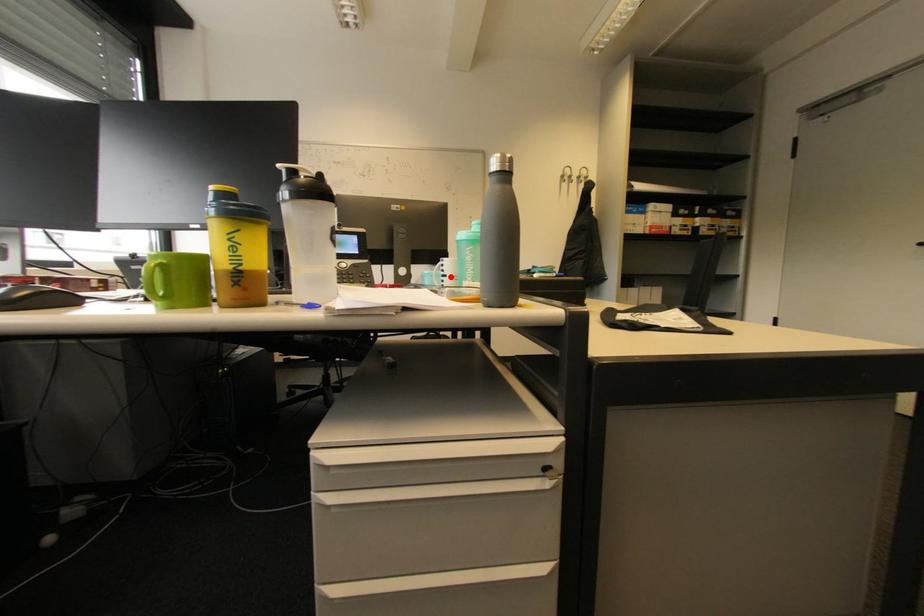
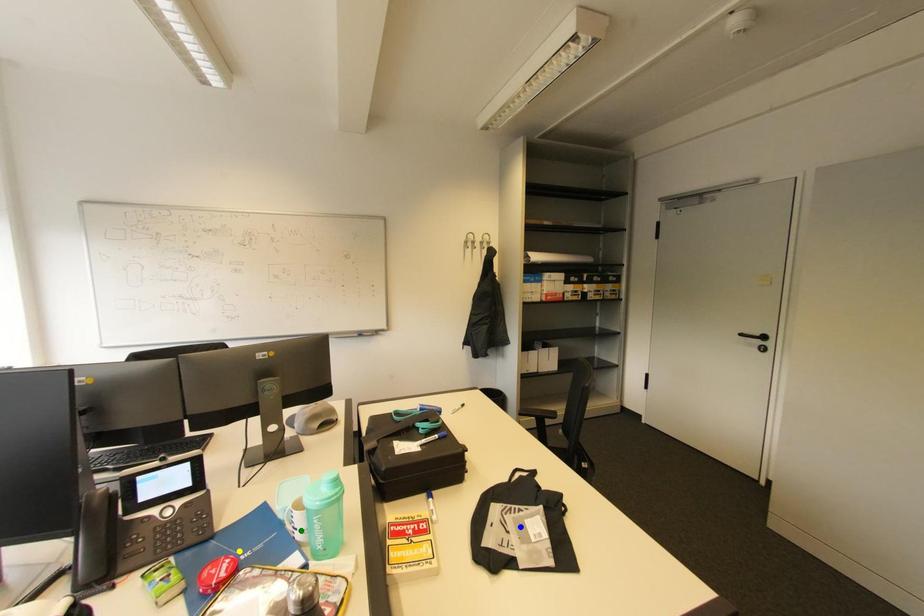
Question: I am providing you with two images of the same scene from different viewpoints. A red point is marked on the first image. You are given multiple points on the second image. Which point in image 2 represents the same 3d spot as the red point in image 1?

Choices:
 (A) green point
 (B) yellow point
 (C) blue point

Answer: (A)